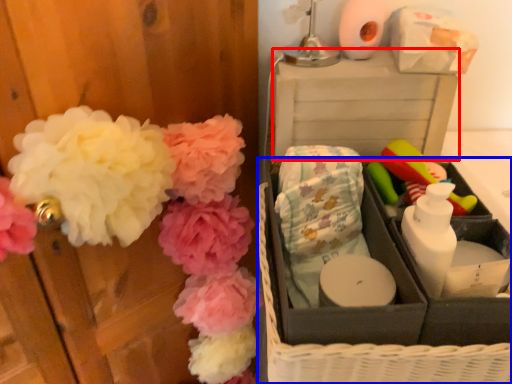
Question: Which point is further to the camera, storage box (highlighted by a red box) or basket (highlighted by a blue box)?

Choices:
 (A) storage box
 (B) basket

Answer: (A)